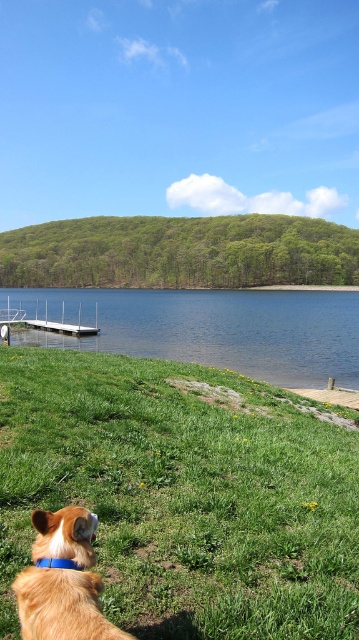
Consider the image. Is blue water at lower center thinner than golden fur dog at lower left?

Incorrect, blue water at lower center's width is not less than golden fur dog at lower left's.

Measure the distance between point (356, 353) and camera.

A distance of 40.95 meters exists between point (356, 353) and camera.

The height and width of the screenshot is (640, 359). I want to click on blue water at lower center, so click(x=211, y=328).

In the scene shown: Is blue water at lower center below white metallic dock at lower left?

Actually, blue water at lower center is above white metallic dock at lower left.

Between blue water at lower center and white metallic dock at lower left, which one is positioned lower?

white metallic dock at lower left

Is point (95, 292) positioned behind point (59, 330)?

Yes, point (95, 292) is farther from viewer.

The width and height of the screenshot is (359, 640). I want to click on blue water at lower center, so click(x=211, y=328).

Locate an element on the screen. The image size is (359, 640). green grassy at lower center is located at coordinates (184, 493).

Which is more to the right, green grassy at lower center or white metallic dock at lower left?

green grassy at lower center

Does point (174, 531) lie in front of point (62, 324)?

Yes, it is in front of point (62, 324).

Locate an element on the screen. Image resolution: width=359 pixels, height=640 pixels. green grassy at lower center is located at coordinates tap(184, 493).